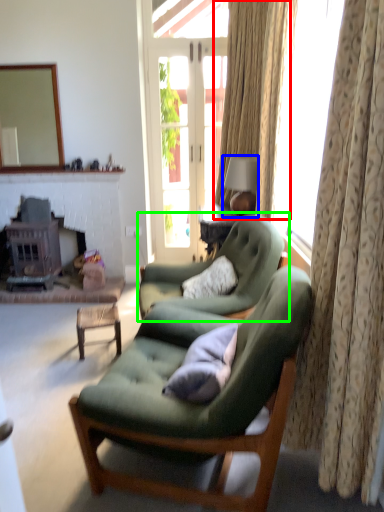
Question: Which object is the farthest from curtain (highlighted by a red box)? Choose among these: lamp (highlighted by a blue box) or chair (highlighted by a green box).

Choices:
 (A) lamp
 (B) chair

Answer: (B)